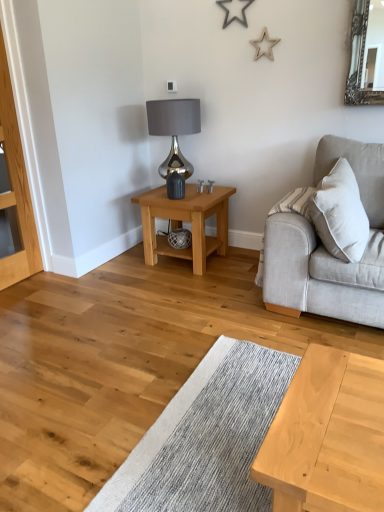
Question: Is light oak dresser at left surrounding satin silver lamp at upper center?

Choices:
 (A) no
 (B) yes

Answer: (A)

Question: From a real-world perspective, is light oak dresser at left on satin silver lamp at upper center?

Choices:
 (A) yes
 (B) no

Answer: (A)

Question: Is the position of light oak dresser at left less distant than that of satin silver lamp at upper center?

Choices:
 (A) no
 (B) yes

Answer: (B)

Question: Does light oak dresser at left come behind satin silver lamp at upper center?

Choices:
 (A) yes
 (B) no

Answer: (B)

Question: Is light oak dresser at left smaller than satin silver lamp at upper center?

Choices:
 (A) yes
 (B) no

Answer: (A)

Question: Does light oak dresser at left turn towards satin silver lamp at upper center?

Choices:
 (A) no
 (B) yes

Answer: (A)

Question: From a real-world perspective, is light brown wooden table at center beneath light gray fabric couch at right?

Choices:
 (A) no
 (B) yes

Answer: (B)

Question: Does light brown wooden table at center lie behind light gray fabric couch at right?

Choices:
 (A) no
 (B) yes

Answer: (B)

Question: Does light brown wooden table at center turn towards light gray fabric couch at right?

Choices:
 (A) yes
 (B) no

Answer: (A)

Question: Can you confirm if light brown wooden table at center is thinner than light gray fabric couch at right?

Choices:
 (A) no
 (B) yes

Answer: (A)

Question: Can you confirm if light brown wooden table at center is smaller than light gray fabric couch at right?

Choices:
 (A) no
 (B) yes

Answer: (B)

Question: Are light brown wooden table at center and light gray fabric couch at right located far from each other?

Choices:
 (A) yes
 (B) no

Answer: (B)

Question: Would you consider light oak dresser at left to be distant from light brown wooden table at center?

Choices:
 (A) yes
 (B) no

Answer: (A)